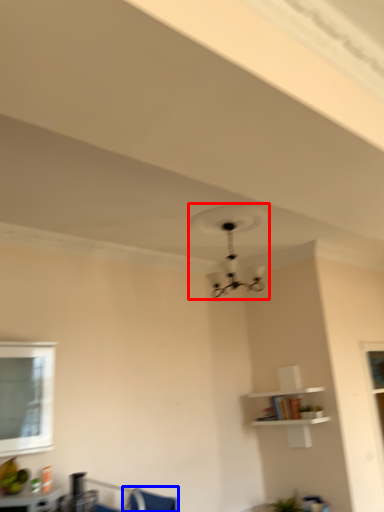
Question: Which point is closer to the camera, fan (highlighted by a red box) or swivel chair (highlighted by a blue box)?

Choices:
 (A) fan
 (B) swivel chair

Answer: (B)